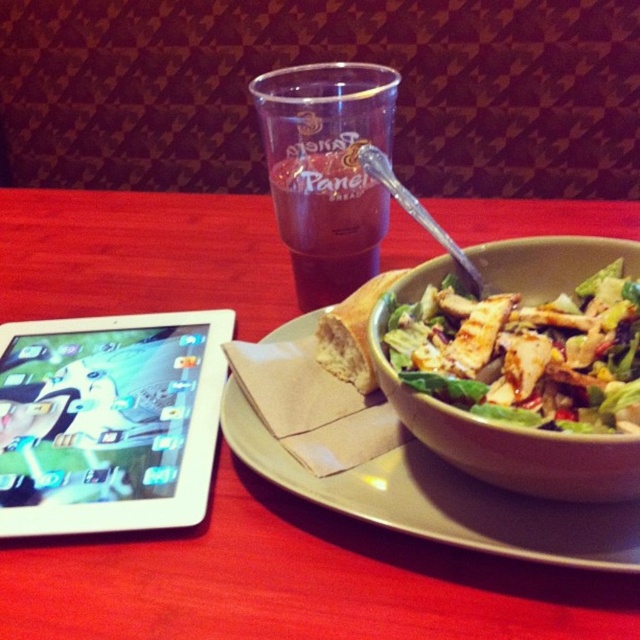
Where is `white glossy tablet at left`? white glossy tablet at left is located at coordinates (108, 420).

Which of these two, white glossy tablet at left or matte ceramic bowl at center right, stands taller?

matte ceramic bowl at center right is taller.

Where is `white glossy tablet at left`? white glossy tablet at left is located at coordinates (108, 420).

Locate an element on the screen. The height and width of the screenshot is (640, 640). white glossy tablet at left is located at coordinates (108, 420).

Is wooden table at center to the right of white glossy tablet at left from the viewer's perspective?

Indeed, wooden table at center is positioned on the right side of white glossy tablet at left.

Describe the element at coordinates (294, 580) in the screenshot. I see `wooden table at center` at that location.

The image size is (640, 640). I want to click on wooden table at center, so click(x=294, y=580).

Can you confirm if matte ceramic plate at center is bigger than matte ceramic bowl at center right?

Yes.

Is the position of matte ceramic plate at center more distant than that of matte ceramic bowl at center right?

Yes, it is behind matte ceramic bowl at center right.

Does point (454, 476) come farther from viewer compared to point (445, 428)?

Yes, it is.

At what (x,y) coordinates should I click in order to perform the action: click on matte ceramic plate at center. Please return your answer as a coordinate pair (x, y). The height and width of the screenshot is (640, 640). Looking at the image, I should click on (442, 500).